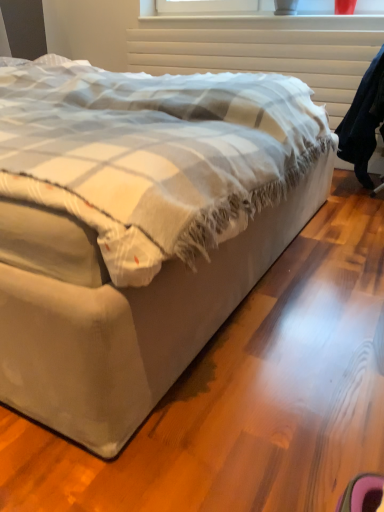
Question: Is beige fabric bed at center positioned with its back to white textured radiator at upper center?

Choices:
 (A) no
 (B) yes

Answer: (A)

Question: From the image's perspective, is beige fabric bed at center located above white textured radiator at upper center?

Choices:
 (A) yes
 (B) no

Answer: (B)

Question: Is beige fabric bed at center further to the viewer compared to white textured radiator at upper center?

Choices:
 (A) yes
 (B) no

Answer: (B)

Question: Can you confirm if beige fabric bed at center is smaller than white textured radiator at upper center?

Choices:
 (A) no
 (B) yes

Answer: (A)

Question: Can you confirm if beige fabric bed at center is wider than white textured radiator at upper center?

Choices:
 (A) yes
 (B) no

Answer: (A)

Question: From the image's perspective, is dark blue fabric robe at right above or below beige fabric bed at center?

Choices:
 (A) below
 (B) above

Answer: (B)

Question: Considering the relative positions of dark blue fabric robe at right and beige fabric bed at center in the image provided, is dark blue fabric robe at right to the left or to the right of beige fabric bed at center?

Choices:
 (A) left
 (B) right

Answer: (B)

Question: Is point (365, 160) closer or farther from the camera than point (91, 75)?

Choices:
 (A) closer
 (B) farther

Answer: (B)

Question: Is dark blue fabric robe at right in front of or behind beige fabric bed at center in the image?

Choices:
 (A) behind
 (B) front

Answer: (A)

Question: Is beige fabric bed at center inside the boundaries of white textured radiator at upper center, or outside?

Choices:
 (A) inside
 (B) outside

Answer: (B)

Question: In terms of height, does beige fabric bed at center look taller or shorter compared to white textured radiator at upper center?

Choices:
 (A) tall
 (B) short

Answer: (A)

Question: Considering their positions, is beige fabric bed at center located in front of or behind white textured radiator at upper center?

Choices:
 (A) front
 (B) behind

Answer: (A)

Question: From a real-world perspective, is beige fabric bed at center above or below white textured radiator at upper center?

Choices:
 (A) below
 (B) above

Answer: (A)

Question: From the image's perspective, is dark blue fabric robe at right positioned above or below white textured radiator at upper center?

Choices:
 (A) above
 (B) below

Answer: (B)

Question: Visually, is dark blue fabric robe at right positioned to the left or to the right of white textured radiator at upper center?

Choices:
 (A) left
 (B) right

Answer: (B)